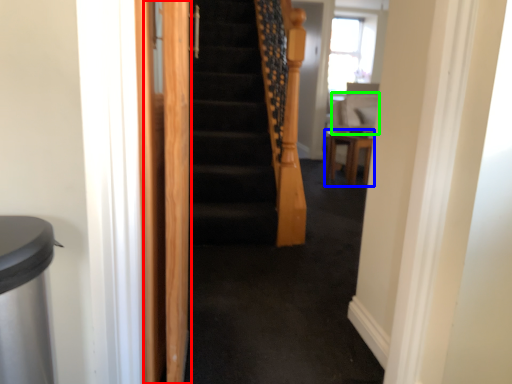
Question: Which object is positioned closest to screen door (highlighted by a red box)? Select from furniture (highlighted by a blue box) and sit (highlighted by a green box).

Choices:
 (A) furniture
 (B) sit

Answer: (A)